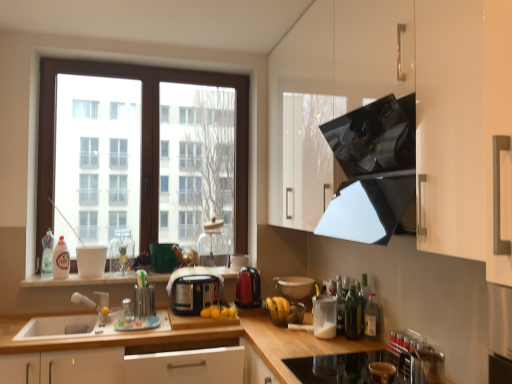
The width and height of the screenshot is (512, 384). Find the location of `vacant space situated on the left part of green glass bottle at lower right, which is the second bottle in right-to-left order`. vacant space situated on the left part of green glass bottle at lower right, which is the second bottle in right-to-left order is located at coordinates (326, 344).